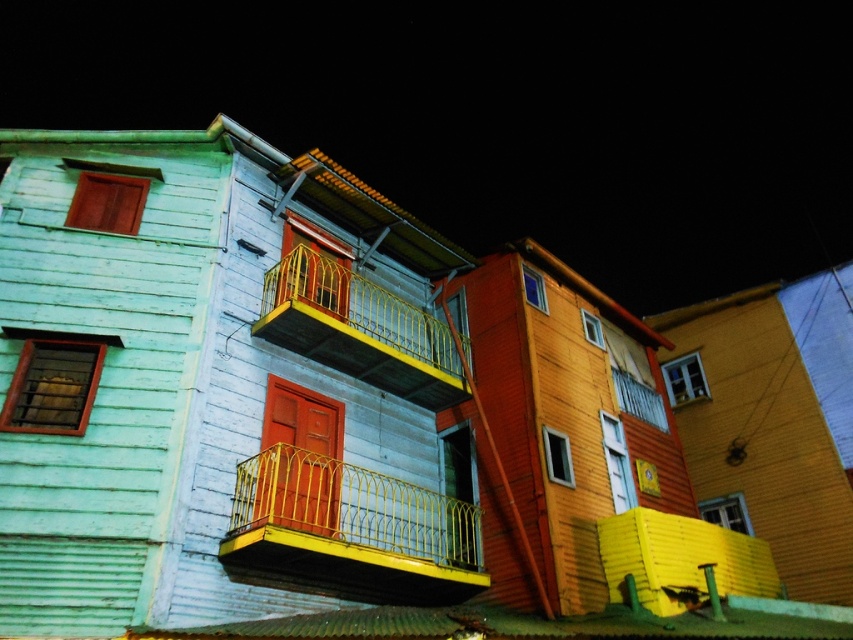
You are a painter standing on the wooden balcony at center and need to reach the yellow metal railing at upper center to touch it. Can you reach it without moving from your current position? Please explain your reasoning.

The wooden balcony at center and yellow metal railing at upper center are 44.91 meters apart from each other. Since 44.91 meters is a significant distance, you cannot reach the yellow metal railing at upper center from the wooden balcony at center without moving.

You are standing in front of the row of colorful houses. You notice a yellow metallic balcony at center and a yellow metal railing at upper center. Which object is located below the other?

The yellow metallic balcony at center is positioned under the yellow metal railing at upper center, so the balcony is below the railing.

You are an architect designing a new balcony for the wooden balcony at center and the yellow metallic balcony at center. Which balcony should you choose to install a larger garden since you need more space?

The wooden balcony at center has a larger size compared to the yellow metallic balcony at center, so you should choose the wooden balcony at center to install a larger garden since it provides more space.